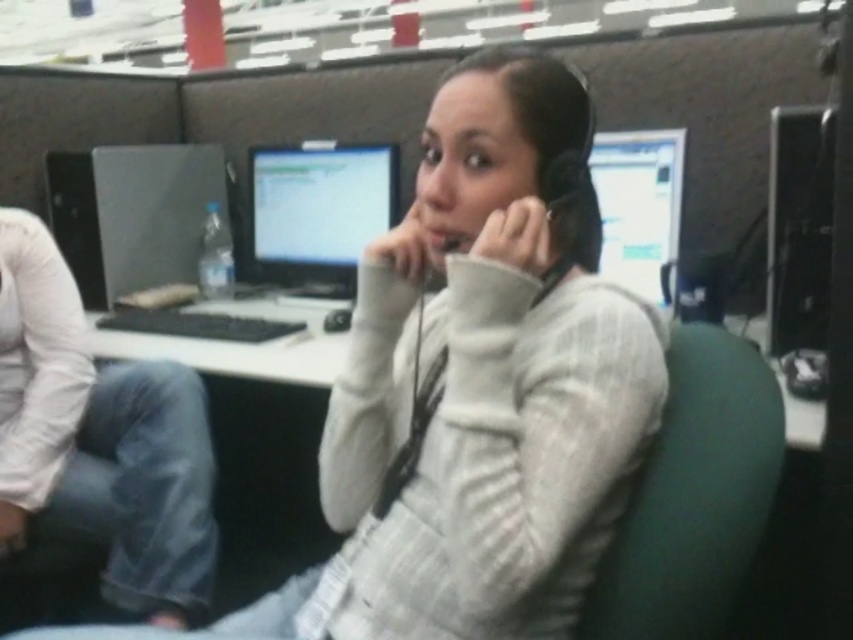
You are a fashion designer analyzing an office worker outfit. You notice two sweaters, a white textured sweater at center and a white cotton sweater at center. Which one is bigger in size?

The white textured sweater at center is larger in size compared to the white cotton sweater at center.

Based on the scene description, where is the white plastic computer desk at center located in terms of its 2D coordinates?

The white plastic computer desk at center is located at the 2D coordinates of point (241, 344).